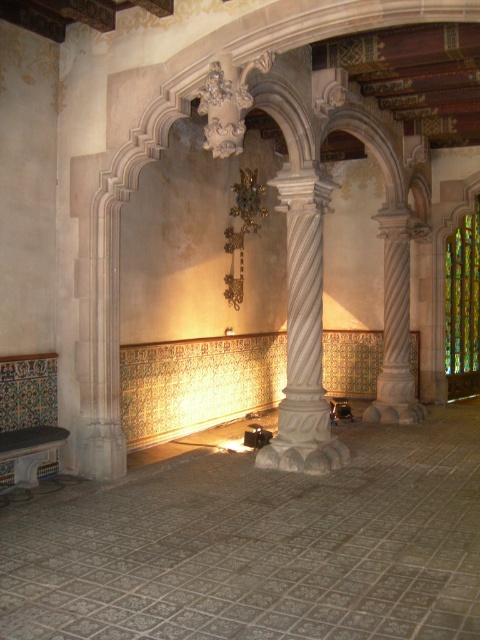
Describe the element at coordinates (303, 332) in the screenshot. I see `white marble column at center` at that location.

Which of these two, white marble column at center or multicolored stained glass at right, stands shorter?

multicolored stained glass at right is shorter.

Between point (310, 332) and point (459, 365), which one is positioned in front?

Positioned in front is point (310, 332).

The width and height of the screenshot is (480, 640). In order to click on white marble column at center in this screenshot , I will do `click(303, 332)`.